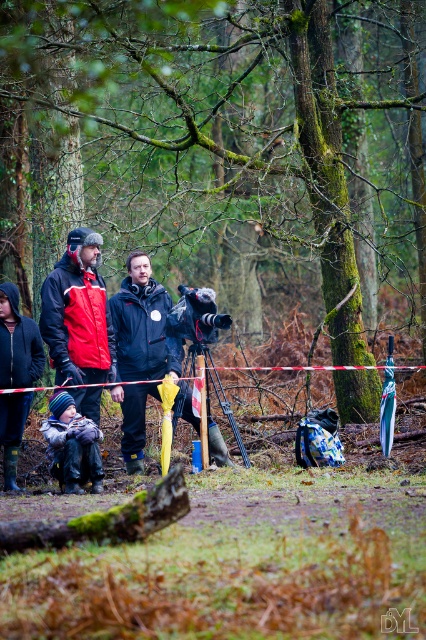
Consider the image. You are navigating through the forest and need to locate the knitted woolen hat at center. According to the coordinates provided, where exactly is it positioned in the image?

The knitted woolen hat at center is located at point coordinates of 0.697 on the x axis and 0.169 on the y axis.

You are a hiker trying to take a photo of the knitted woolen hat at center. You notice there is a mossy bark log at lower center blocking your view. Can you move the log to get a clear shot?

The mossy bark log at lower center is closer to the viewer than the knitted woolen hat at center, so moving the log would allow you to get a clear view of the knitted woolen hat at center.

You are standing in a forest on a rainy day. You see a dark blue fabric jacket at center. Can you reach it within 10 meters without moving?

The dark blue fabric jacket at center is 9.24 meters away from you, so yes, you can reach it within 10 meters without moving.